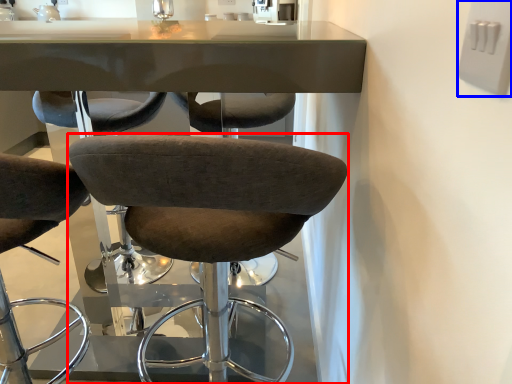
Question: Among these objects, which one is nearest to the camera, chair (highlighted by a red box) or electric outlet (highlighted by a blue box)?

Choices:
 (A) chair
 (B) electric outlet

Answer: (B)